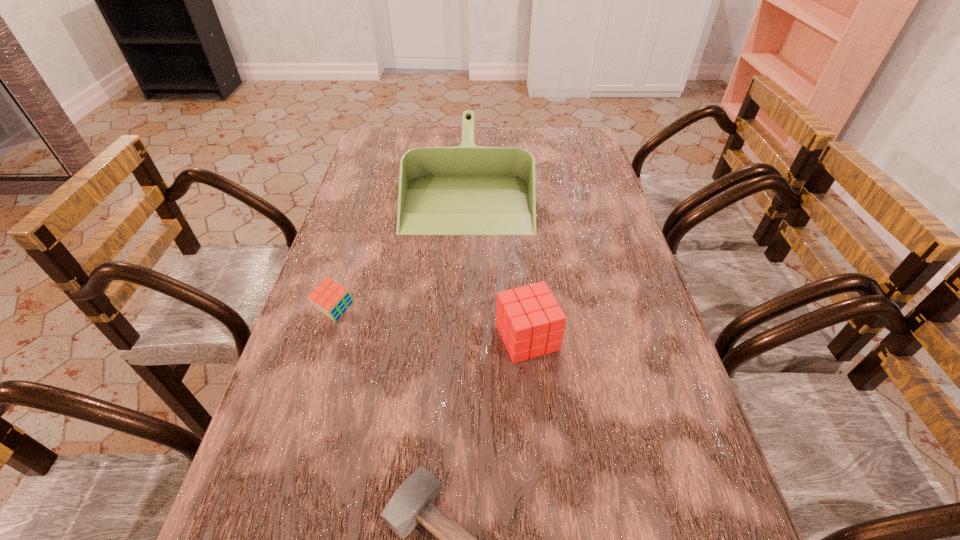
Where is `object that is the second closest to the taller cube`? Image resolution: width=960 pixels, height=540 pixels. object that is the second closest to the taller cube is located at coordinates coord(463,190).

At what (x,y) coordinates should I click in order to perform the action: click on vacant region that satisfies the following two spatial constraints: 1. on the front side of the left cube; 2. on the left side of the taller cube. Please return your answer as a coordinate pair (x, y). Image resolution: width=960 pixels, height=540 pixels. Looking at the image, I should click on (328, 338).

The image size is (960, 540). Identify the location of free region that satisfies the following two spatial constraints: 1. on the front side of the second shortest object; 2. on the right side of the taller cube. (328, 338).